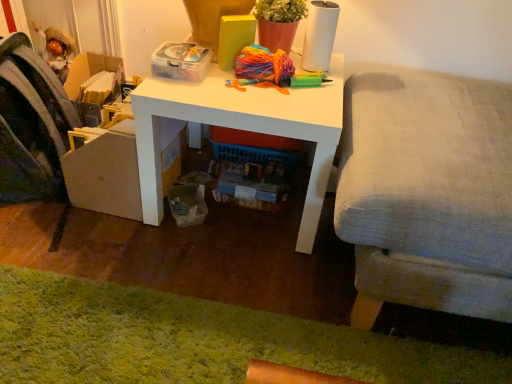
Locate an element on the screen. This screenshot has width=512, height=384. vacant area to the right of transparent plastic storage box at upper center is located at coordinates (229, 82).